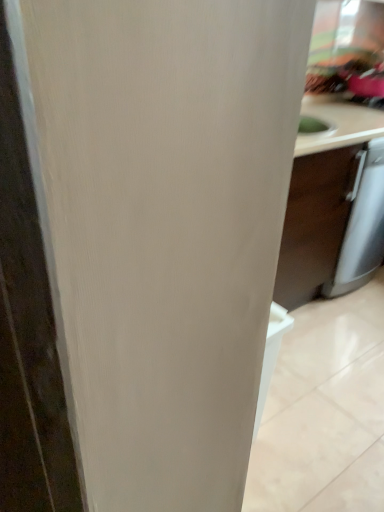
This screenshot has height=512, width=384. What do you see at coordinates (332, 224) in the screenshot? I see `matte brown cabinet at right` at bounding box center [332, 224].

You are a GUI agent. You are given a task and a screenshot of the screen. Output one action in this format:
    pyautogui.click(x=<x>, y=<y>)
    Task: Click on the matte brown cabinet at right
    
    Given the screenshot: What is the action you would take?
    pyautogui.click(x=332, y=224)

The image size is (384, 512). Identify the location of matte brown cabinet at right. (332, 224).